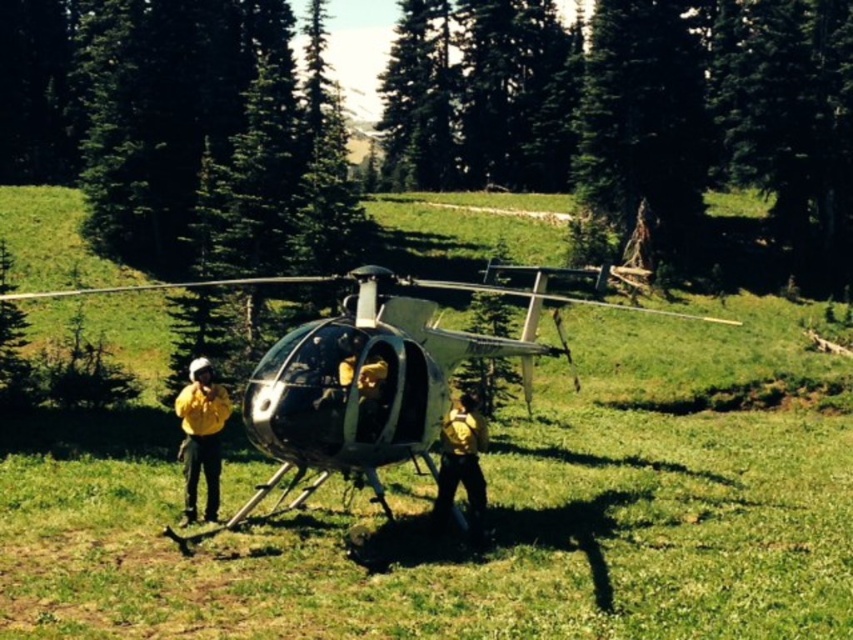
Question: Which point appears closest to the camera in this image?

Choices:
 (A) (633, 310)
 (B) (218, 454)

Answer: (B)

Question: Can you confirm if metallic silver helicopter at center is positioned to the right of yellow fireproof suit at left?

Choices:
 (A) no
 (B) yes

Answer: (B)

Question: Which point is farther from the camera taking this photo?

Choices:
 (A) (198, 472)
 (B) (436, 525)

Answer: (A)

Question: Which point appears farthest from the camera in this image?

Choices:
 (A) (187, 499)
 (B) (442, 493)

Answer: (A)

Question: Can you confirm if metallic silver helicopter at center is bigger than yellow fireproof suit at left?

Choices:
 (A) yes
 (B) no

Answer: (A)

Question: From the image, what is the correct spatial relationship of metallic silver helicopter at center in relation to yellow fireproof suit at left?

Choices:
 (A) above
 (B) below

Answer: (A)